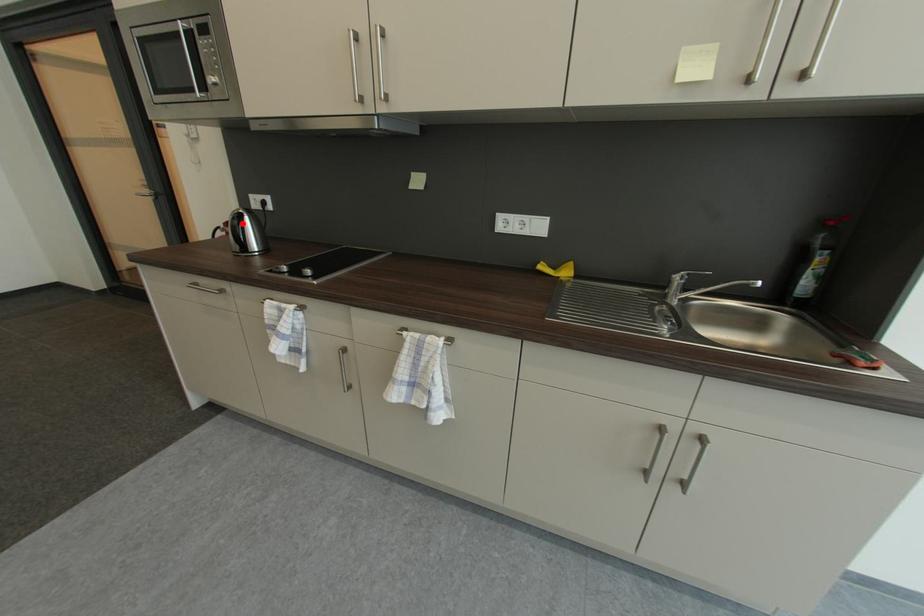
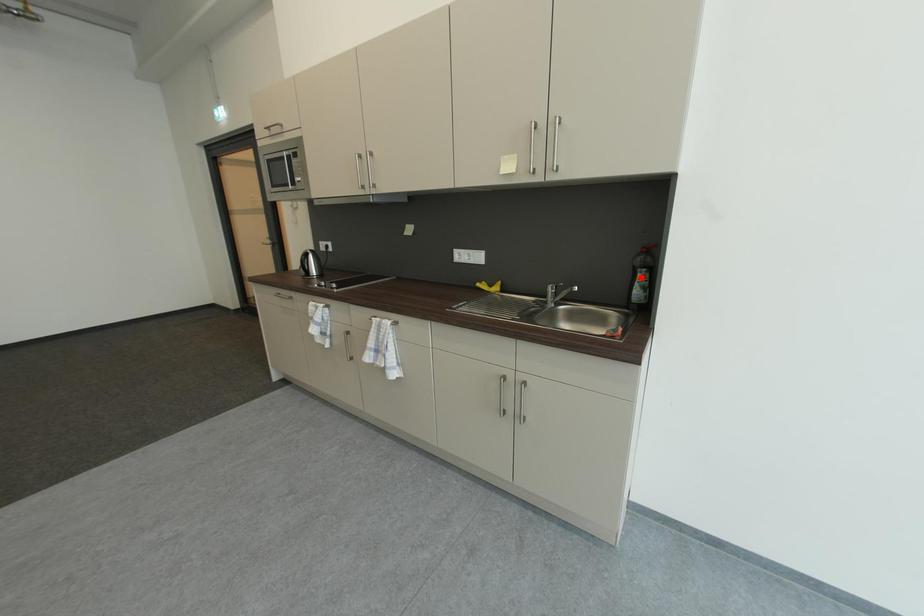
I am providing you with two images of the same scene from different viewpoints. A red point is marked on the first image and another point is marked on the second image. Does the point marked in image1 correspond to the same location as the one in image2?

No